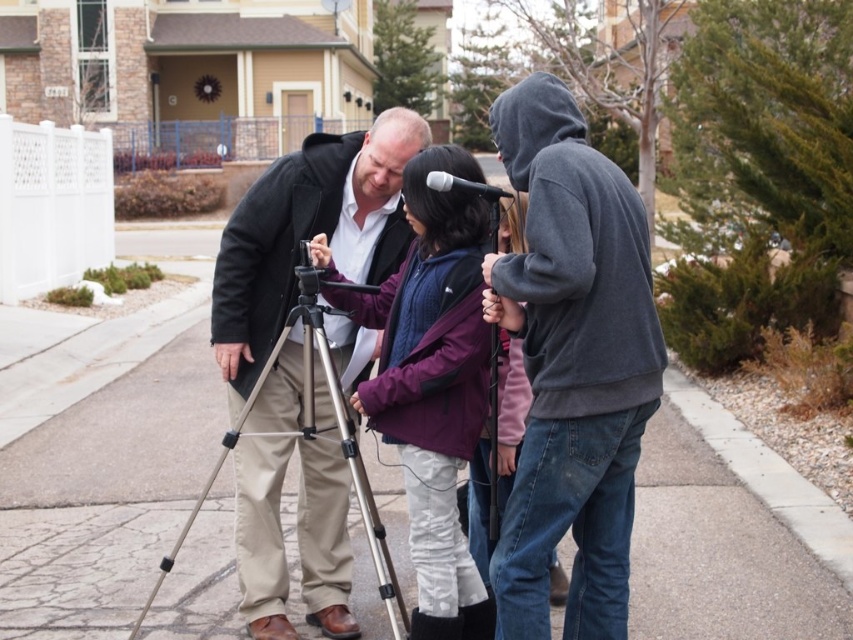
Question: Which object appears closest to the camera in this image?

Choices:
 (A) matte gray hoodie at center
 (B) gray concrete curb at lower right
 (C) gray hoodie at center

Answer: (C)

Question: Can you confirm if gray hoodie at center is wider than silver metallic tripod at center?

Choices:
 (A) no
 (B) yes

Answer: (A)

Question: Where is metallic tripod at center located in relation to gray concrete curb at lower right in the image?

Choices:
 (A) below
 (B) above

Answer: (A)

Question: Estimate the real-world distances between objects in this image. Which object is closer to the gray hoodie at center?

Choices:
 (A) matte gray hoodie at center
 (B) purple fleece jacket at center
 (C) gray concrete curb at lower right

Answer: (B)

Question: Can you confirm if gray hoodie at center is wider than silver metallic tripod at center?

Choices:
 (A) yes
 (B) no

Answer: (B)

Question: Considering the real-world distances, which object is closest to the silver metallic tripod at center?

Choices:
 (A) matte gray hoodie at center
 (B) gray concrete curb at lower right
 (C) metallic tripod at center

Answer: (A)